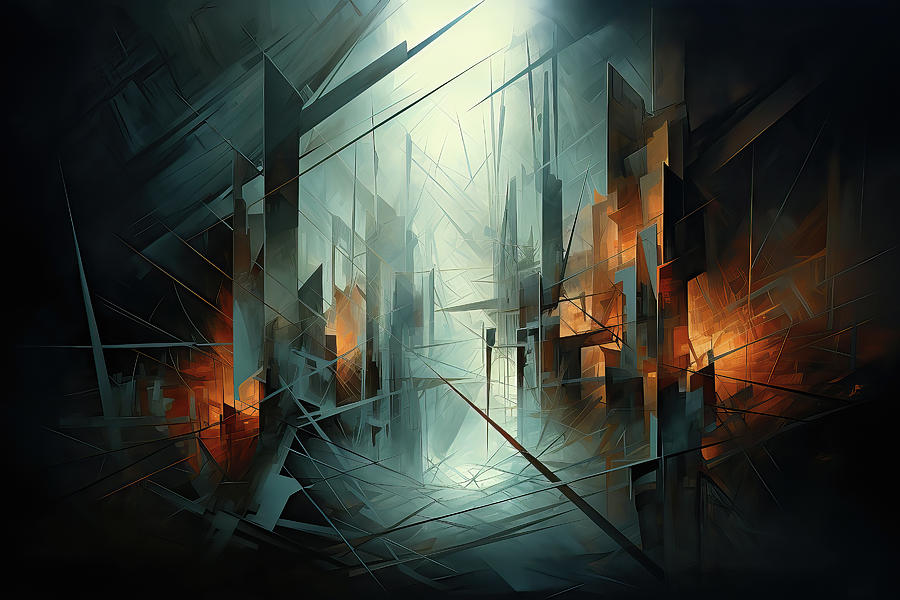
Locate an element on the screen. pillar is located at coordinates tap(651, 207).